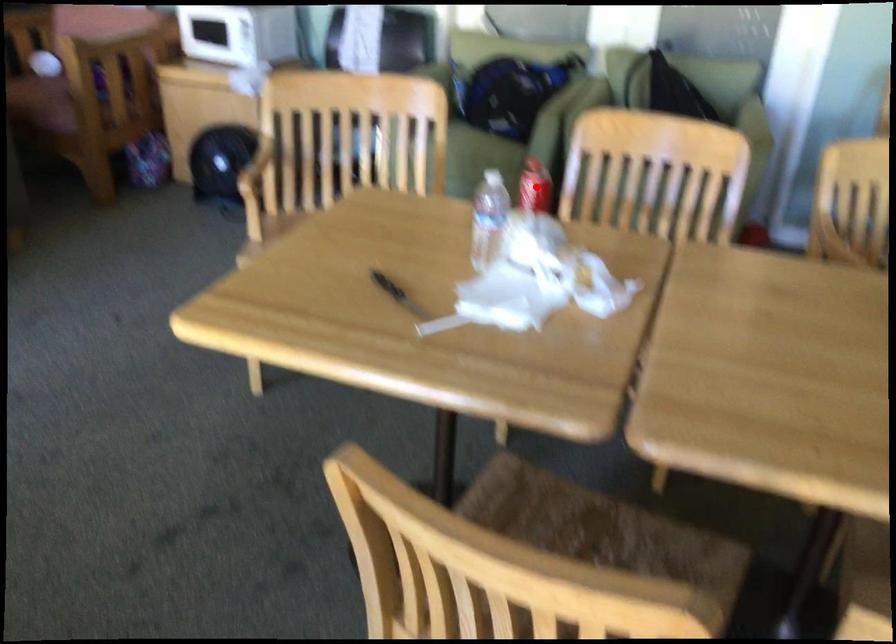
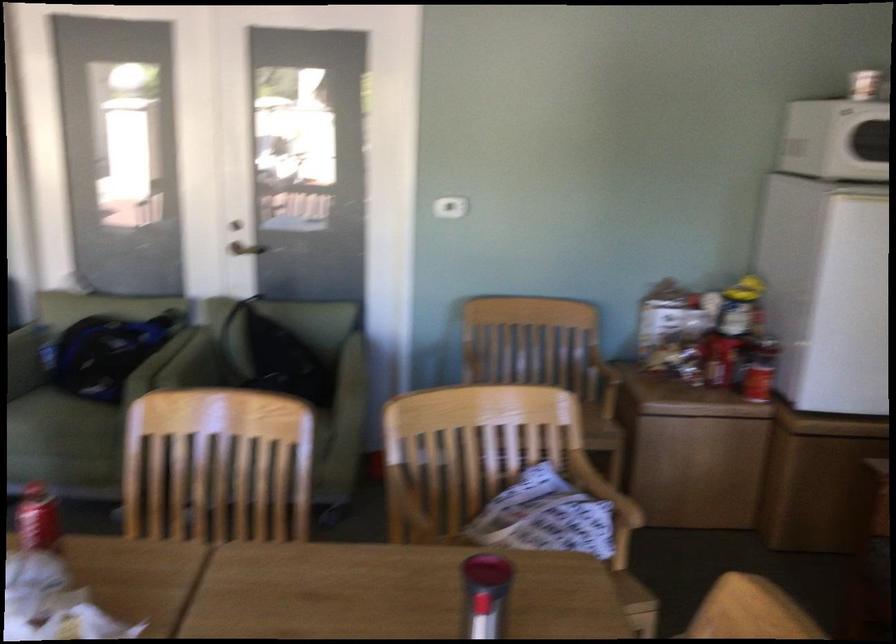
In the second image, find the point that corresponds to the highlighted location in the first image.

(37, 518)